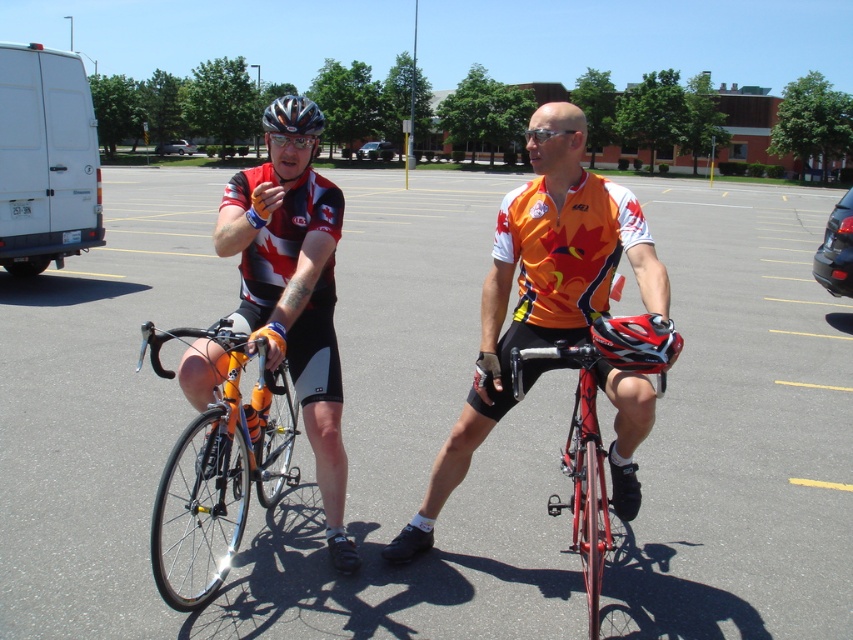
Between orange jersey at center and matte black goggles at center, which one is positioned higher?

matte black goggles at center is above.

Is orange jersey at center behind matte black goggles at center?

That is False.

Image resolution: width=853 pixels, height=640 pixels. Describe the element at coordinates (540, 288) in the screenshot. I see `orange jersey at center` at that location.

The height and width of the screenshot is (640, 853). I want to click on orange jersey at center, so 540,288.

The width and height of the screenshot is (853, 640). In order to click on gray asphalt parking lot at center in this screenshot , I will do `click(296, 440)`.

Is point (299, 529) positioned before point (543, 252)?

No, it is behind (543, 252).

Which is behind, point (20, 305) or point (535, 282)?

Point (20, 305)

This screenshot has width=853, height=640. Find the location of `gray asphalt parking lot at center`. gray asphalt parking lot at center is located at coordinates pos(296,440).

Is matte black cycling jersey at center closer to camera compared to matte black goggles at center?

Yes, it is in front of matte black goggles at center.

Does matte black cycling jersey at center have a greater height compared to matte black goggles at center?

Correct, matte black cycling jersey at center is much taller as matte black goggles at center.

Find the location of a particular element. The width and height of the screenshot is (853, 640). matte black cycling jersey at center is located at coordinates (294, 301).

The width and height of the screenshot is (853, 640). In order to click on matte black cycling jersey at center in this screenshot , I will do `click(294, 301)`.